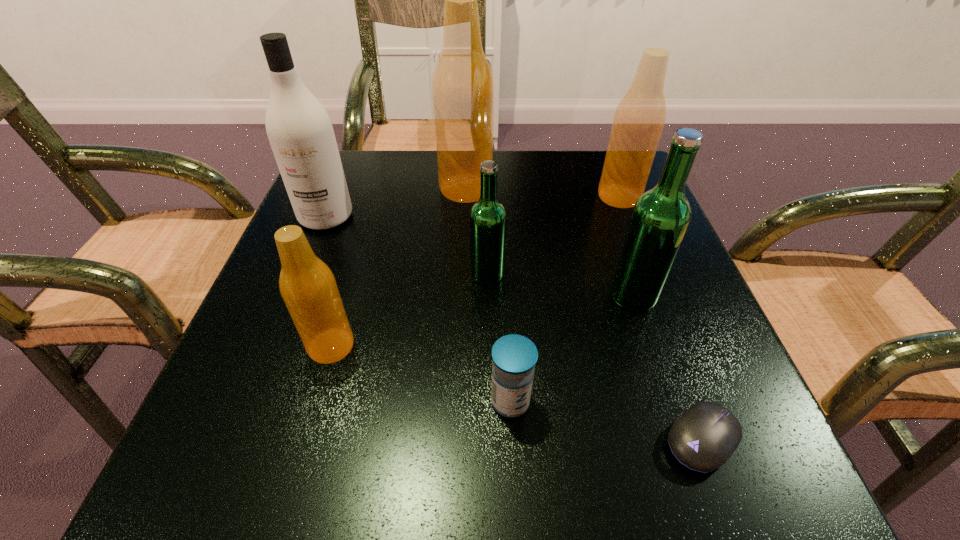
This screenshot has height=540, width=960. Find the location of `the biggest tan beer bottle`. the biggest tan beer bottle is located at coordinates (462, 86).

Where is `the tallest beer bottle`? The width and height of the screenshot is (960, 540). the tallest beer bottle is located at coordinates (462, 86).

Image resolution: width=960 pixels, height=540 pixels. I want to click on white shampoo, so click(300, 132).

Where is `the second smallest tan beer bottle`? This screenshot has width=960, height=540. the second smallest tan beer bottle is located at coordinates (639, 119).

Where is `the bigger green beer bottle`? This screenshot has width=960, height=540. the bigger green beer bottle is located at coordinates (660, 218).

At what (x,y) coordinates should I click in order to perform the action: click on the left green beer bottle. Please return your answer as a coordinate pair (x, y). The image size is (960, 540). Looking at the image, I should click on (488, 219).

Locate an element on the screen. the nearest tan beer bottle is located at coordinates (308, 287).

Locate an element on the screen. The image size is (960, 540). the smallest tan beer bottle is located at coordinates (308, 287).

Locate an element on the screen. This screenshot has width=960, height=540. medicine is located at coordinates (514, 357).

At what (x,y) coordinates should I click in order to perform the action: click on the seventh tallest object. Please return your answer as a coordinate pair (x, y). Looking at the image, I should click on (514, 357).